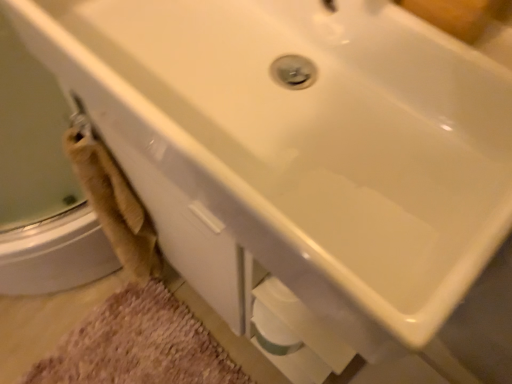
This screenshot has height=384, width=512. Find the location of `free space below beige shaggy bath mat at lower left (from a real-world perspective)`. free space below beige shaggy bath mat at lower left (from a real-world perspective) is located at coordinates (141, 346).